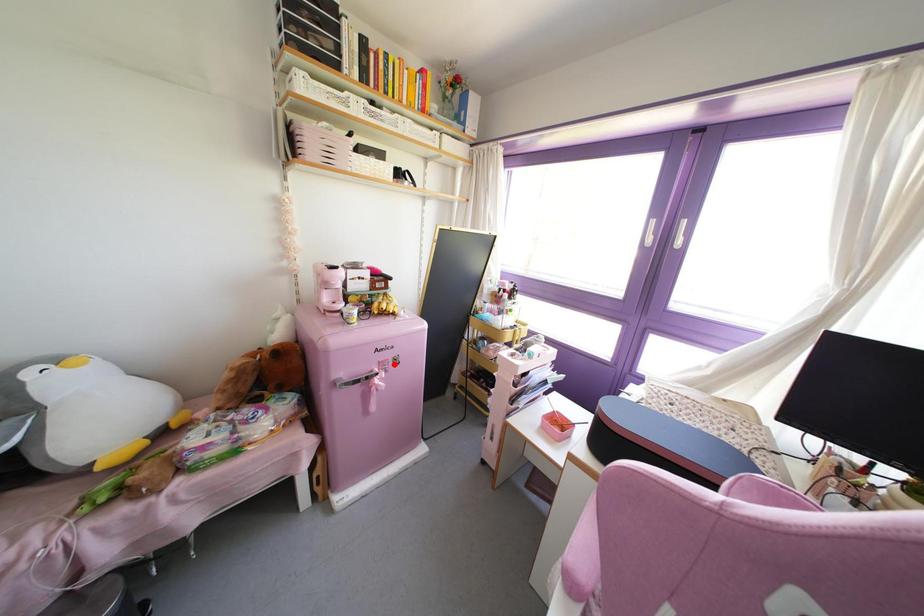
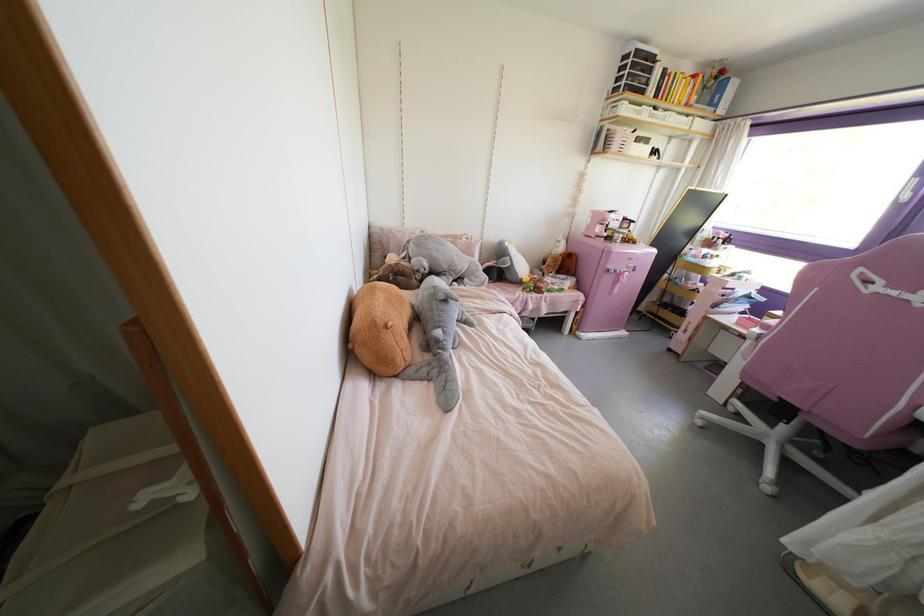
Question: I am providing you with two images of the same scene from different viewpoints. A red point is marked on the first image. At the location where the point appears in image 1, is it still visible in image 2?

Choices:
 (A) Yes
 (B) No

Answer: (A)